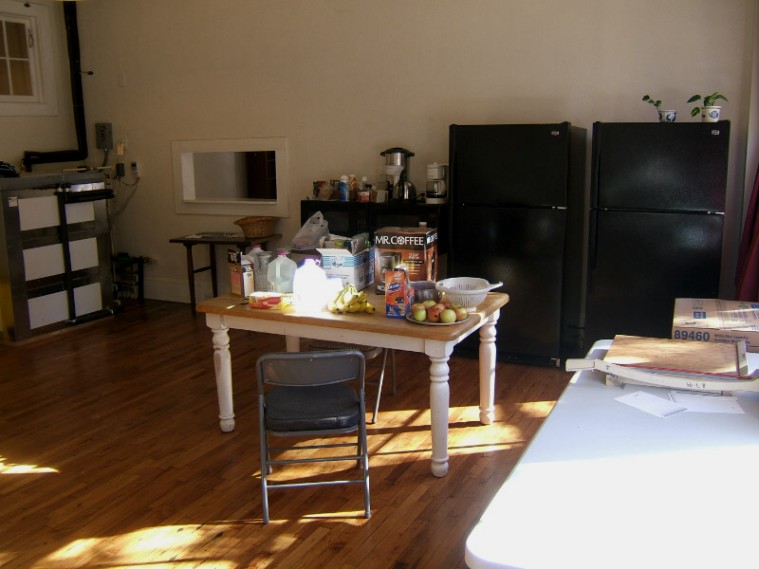
Find the location of a particular element. This screenshot has width=759, height=569. bottom fridge is located at coordinates click(x=646, y=238).